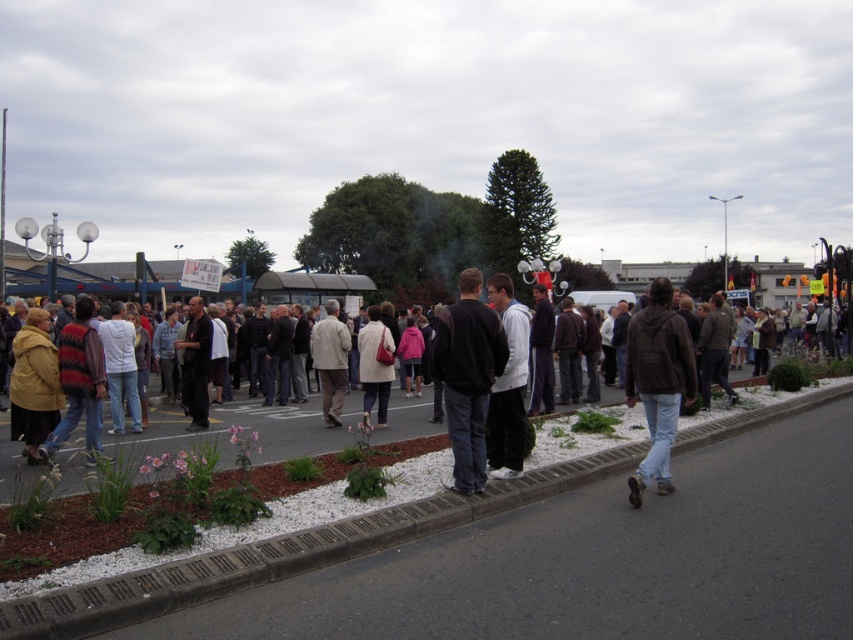
You are a photographer trying to capture a closeup of the dark gray hoodie at center and the matte beige coat at center. Since both are at the center, which one is closer to the camera?

The dark gray hoodie at center is positioned over matte beige coat at center, so it is closer to the camera.

You are standing at the edge of the crowd in the parking lot and notice two points marked in the scene. Which point, point (32, 372) or point (380, 408), is closer to you?

Point (32, 372) is closer to the viewer than point (380, 408).

You are a photographer trying to capture a clear shot of both the brown leather jacket at lower right and the matte yellow jacket at left. Since you want both jackets to be visible in the frame, which jacket might you need to adjust your focus on to ensure it doesn not get cropped out?

The brown leather jacket at lower right has a greater height compared to matte yellow jacket at left, so you should focus on the brown leather jacket at lower right to ensure it fits within the frame.